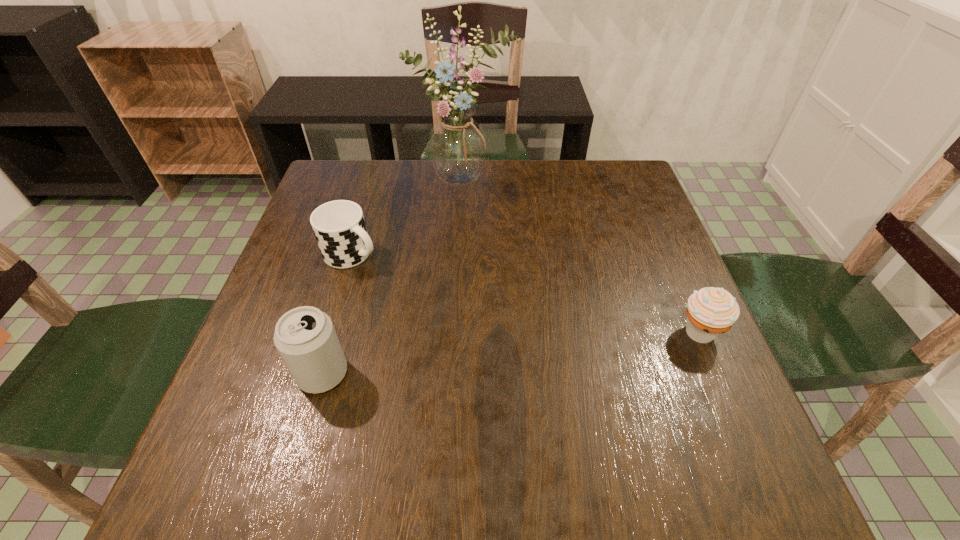
Locate an element on the screen. vacant space on the desktop that is between the can and the muffin and is positioned on the side of the second farthest object with the handle is located at coordinates coord(527,351).

Locate an element on the screen. This screenshot has height=540, width=960. vacant spot on the desktop that is between the third shortest object and the rightmost object and is positioned on the front-facing side of the farthest object is located at coordinates (564, 347).